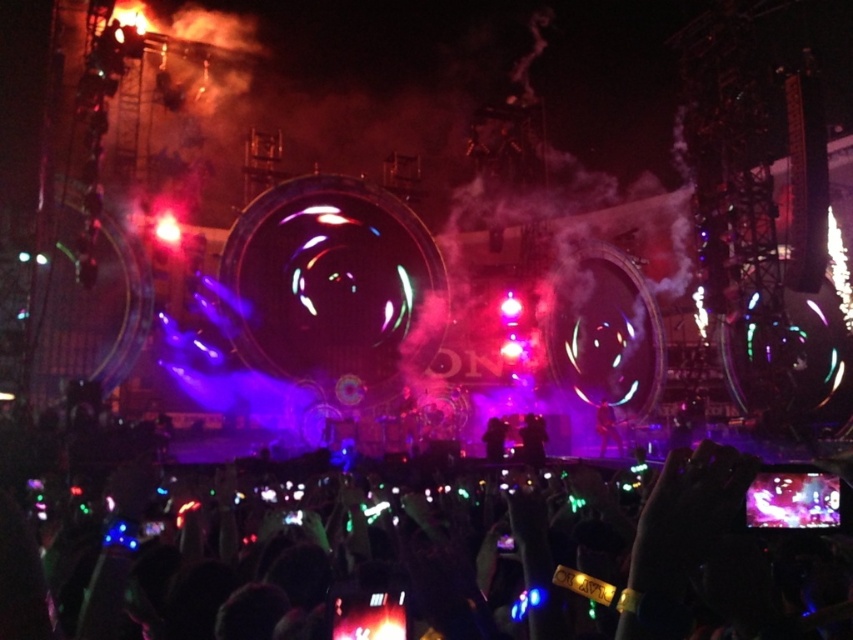
Question: Does black matte figure at center appear under black velvet suit at center?

Choices:
 (A) no
 (B) yes

Answer: (A)

Question: Where is black matte figure at center located in relation to shiny metallic guitar at center in the image?

Choices:
 (A) below
 (B) above

Answer: (A)

Question: Which point appears farthest from the camera in this image?

Choices:
 (A) (491, 458)
 (B) (544, 433)

Answer: (B)

Question: Observing the image, what is the correct spatial positioning of silvery reflective phone at center in reference to shiny metallic guitar at center?

Choices:
 (A) above
 (B) below

Answer: (B)

Question: Among these objects, which one is farthest from the camera?

Choices:
 (A) black velvet suit at center
 (B) silvery reflective phone at center

Answer: (A)

Question: Which is nearer to the black velvet suit at center?

Choices:
 (A) shiny metallic guitar at center
 (B) silvery reflective phone at center

Answer: (A)